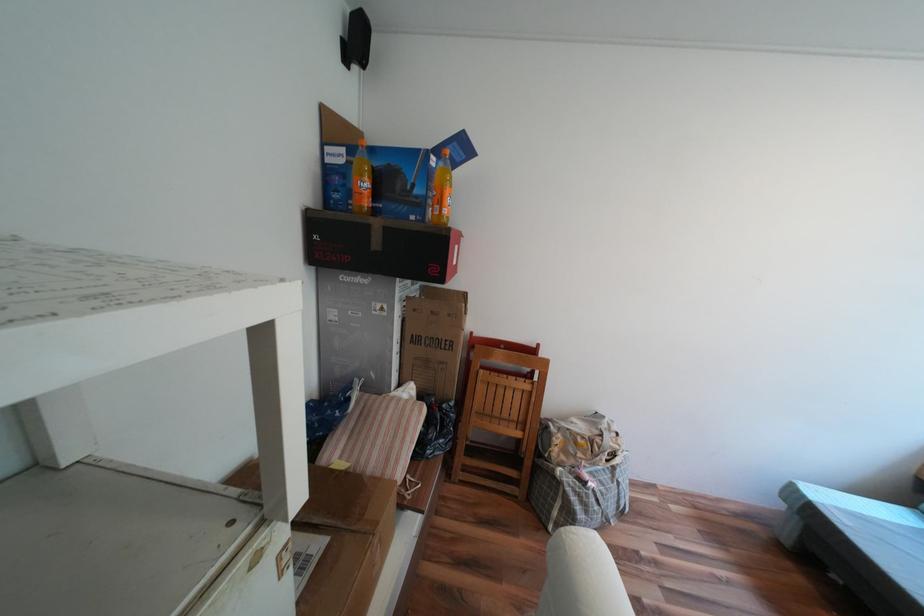
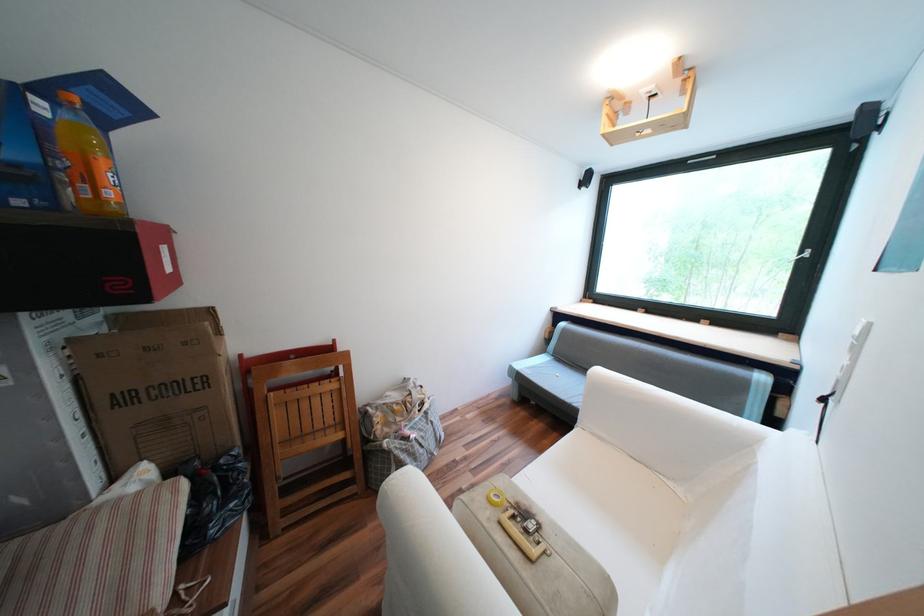
Question: Based on the continuous images, in which direction is the camera rotating? Reply with the corresponding letter.

Choices:
 (A) Left
 (B) Right
 (C) Up
 (D) Down

Answer: (B)